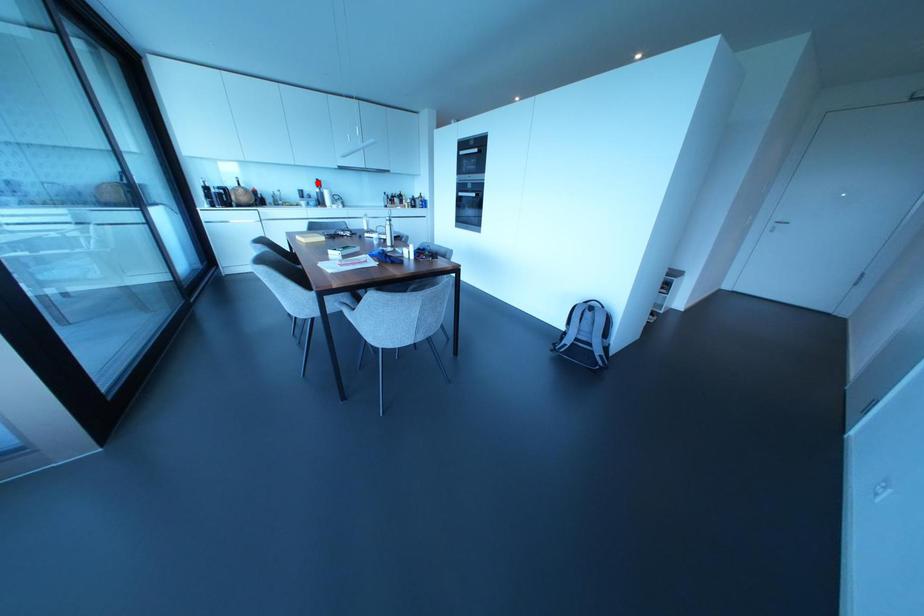
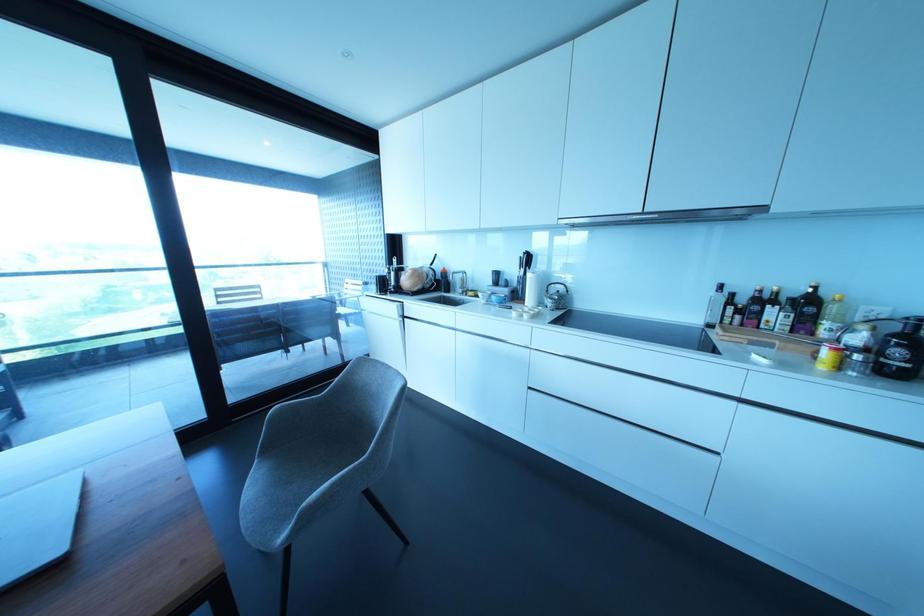
The point at the highlighted location is marked in the first image. Where is the corresponding point in the second image?

(527, 259)